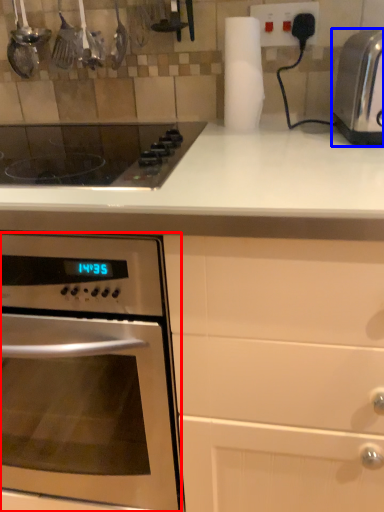
Question: Which object is further to the camera taking this photo, oven (highlighted by a red box) or toaster (highlighted by a blue box)?

Choices:
 (A) oven
 (B) toaster

Answer: (B)